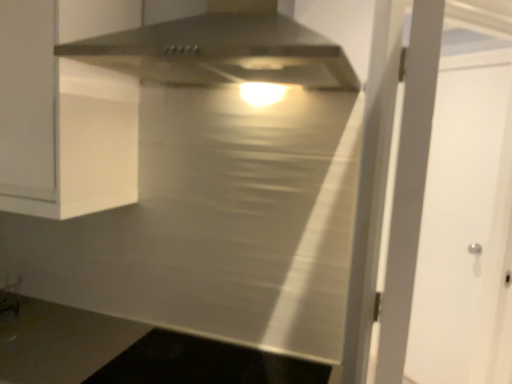
Question: From the image's perspective, is white matte door at right positioned above or below black glass cooktop at lower center?

Choices:
 (A) below
 (B) above

Answer: (B)

Question: Is white matte door at right spatially inside black glass cooktop at lower center, or outside of it?

Choices:
 (A) inside
 (B) outside

Answer: (B)

Question: Which is nearer to the black glass cooktop at lower center?

Choices:
 (A) white matte door at right
 (B) stainless steel range hood at upper center

Answer: (B)

Question: Estimate the real-world distances between objects in this image. Which object is closer to the black glass cooktop at lower center?

Choices:
 (A) stainless steel range hood at upper center
 (B) white matte door at right

Answer: (A)